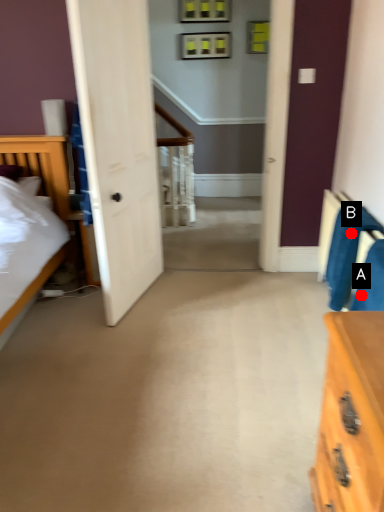
Question: Two points are circled on the image, labeled by A and B beside each circle. Among these points, which one is nearest to the camera?

Choices:
 (A) A is closer
 (B) B is closer

Answer: (A)